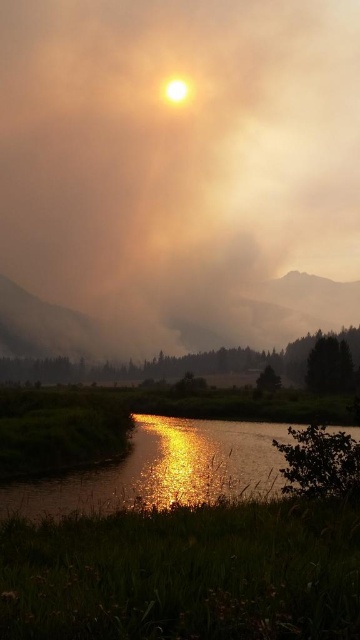
You are a photographer trying to capture the sunrise reflection on the river. You notice a point marked at coordinates (177, 173) in the scene. What is located at that point?

The foggy smoke at upper center is located at the point marked by coordinates (177, 173).

You are a photographer trying to capture the reflection of the sun in the shiny reflective water at lower center. However, the foggy smoke at upper center is obstructing your view. Can you determine if the smoke is closer to you or farther away than the water?

The foggy smoke at upper center is further to the viewer than the shiny reflective water at lower center, so the smoke is actually farther away from you than the water. Therefore, the smoke is not obstructing the view directly in front of you but is located behind the water in terms of depth, meaning it might still affect the overall lighting and clarity of the reflection.